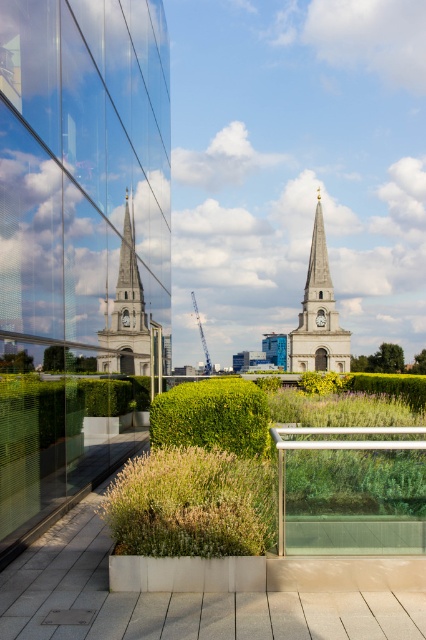
You are an architect analyzing the image. You notice both the white stone church at center and the white stone clock tower at center. Which of these two structures appears bigger in the image?

The white stone church at center appears bigger because it has a larger size compared to the white stone clock tower at center.

You are standing on a rooftop overlooking a cityscape. You see a white stone church at center and a white stone clock tower at center. Which structure is closer to you?

The white stone church at center is closer to you since it is in front of the white stone clock tower at center.